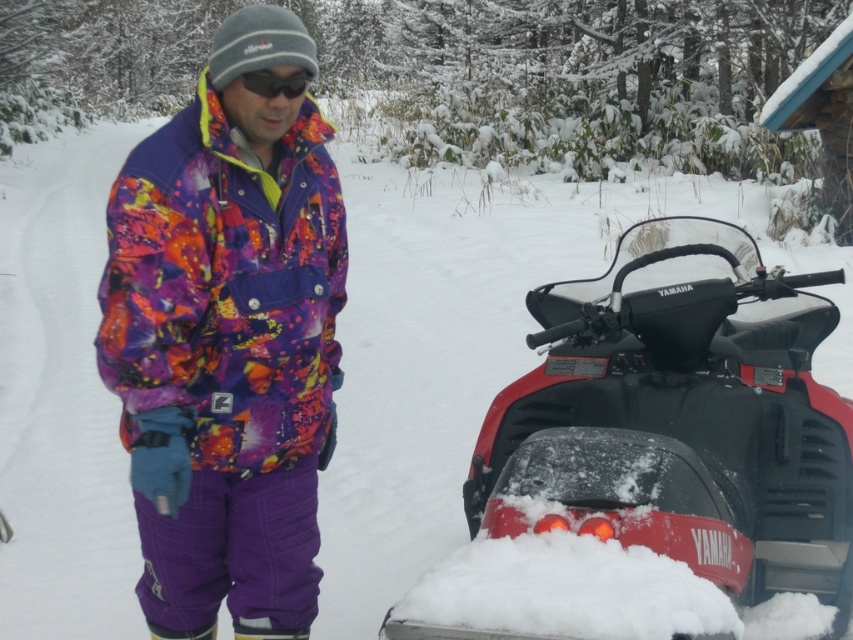
You are a photographer trying to capture the Yamaha snowmobile in the snowy scene. You notice a point labeled as point (x=276, y=83) in your camera viewfinder. Based on the description, what object is located at that point?

The point (x=276, y=83) corresponds to the black matte sunglasses at upper center.

You are a winter sports instructor preparing to demonstrate ski boot sizes to your students. You have two boots in front of you, the matte purple ski boot at lower center and the purple synthetic ski boot at lower center. Which boot is smaller in size?

The matte purple ski boot at lower center is smaller in size compared to the purple synthetic ski boot at lower center.